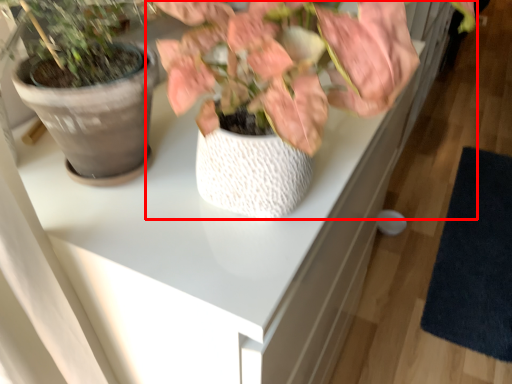
Question: Considering the relative positions of houseplant (annotated by the red box) and mat in the image provided, where is houseplant (annotated by the red box) located with respect to the staircase?

Choices:
 (A) right
 (B) left

Answer: (B)